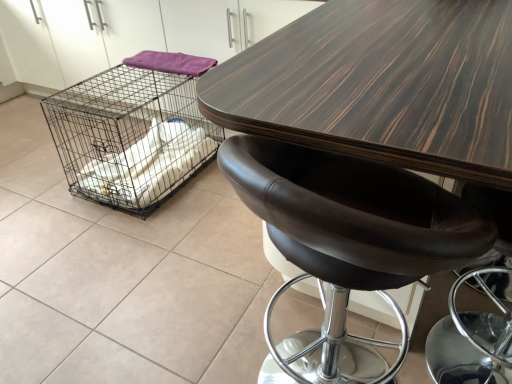
Question: Does black wire mesh cage at left have a lesser width compared to purple fabric at upper left?

Choices:
 (A) yes
 (B) no

Answer: (B)

Question: Is black wire mesh cage at left shorter than purple fabric at upper left?

Choices:
 (A) yes
 (B) no

Answer: (B)

Question: Is black wire mesh cage at left located outside purple fabric at upper left?

Choices:
 (A) no
 (B) yes

Answer: (B)

Question: Considering the relative sizes of black wire mesh cage at left and purple fabric at upper left in the image provided, is black wire mesh cage at left wider than purple fabric at upper left?

Choices:
 (A) yes
 (B) no

Answer: (A)

Question: Can you confirm if black wire mesh cage at left is positioned to the left of purple fabric at upper left?

Choices:
 (A) yes
 (B) no

Answer: (A)

Question: Considering the positions of brown leather stool at center and dark wood table at center in the image, is brown leather stool at center wider or thinner than dark wood table at center?

Choices:
 (A) wide
 (B) thin

Answer: (B)

Question: Considering their positions, is brown leather stool at center located in front of or behind dark wood table at center?

Choices:
 (A) behind
 (B) front

Answer: (B)

Question: In the image, is brown leather stool at center on the left side or the right side of dark wood table at center?

Choices:
 (A) right
 (B) left

Answer: (A)

Question: From a real-world perspective, is brown leather stool at center positioned above or below dark wood table at center?

Choices:
 (A) above
 (B) below

Answer: (B)

Question: In terms of width, does black wire mesh cage at left look wider or thinner when compared to dark wood table at center?

Choices:
 (A) wide
 (B) thin

Answer: (B)

Question: From their relative heights in the image, would you say black wire mesh cage at left is taller or shorter than dark wood table at center?

Choices:
 (A) tall
 (B) short

Answer: (B)

Question: Visually, is black wire mesh cage at left positioned to the left or to the right of dark wood table at center?

Choices:
 (A) right
 (B) left

Answer: (B)

Question: From a real-world perspective, is black wire mesh cage at left above or below dark wood table at center?

Choices:
 (A) above
 (B) below

Answer: (B)

Question: Relative to purple fabric at upper left, is dark wood table at center in front or behind?

Choices:
 (A) front
 (B) behind

Answer: (A)

Question: Is point (294, 56) closer or farther from the camera than point (206, 64)?

Choices:
 (A) closer
 (B) farther

Answer: (A)